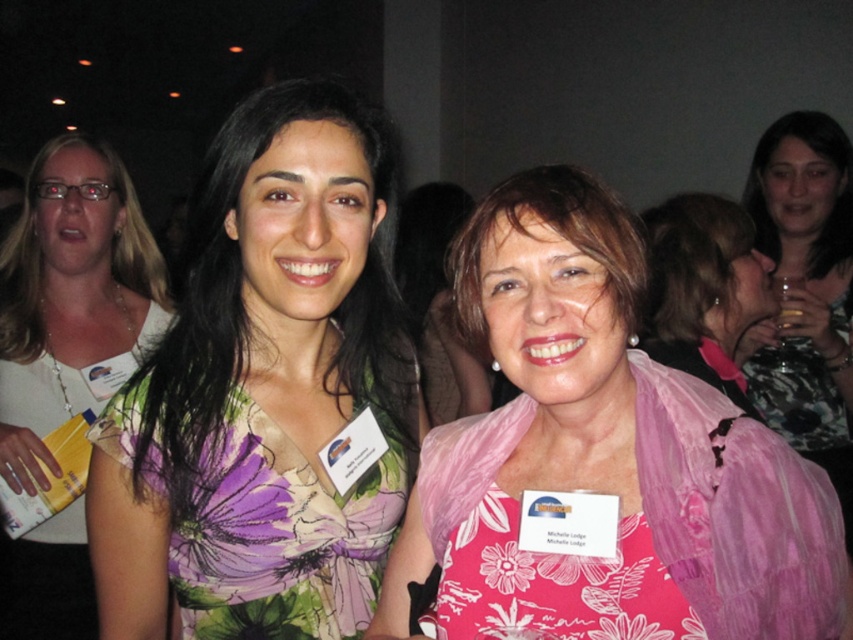
You are a photographer adjusting your camera settings. You notice the white glossy name tag at left in your viewfinder. To avoid glare, you need to ensure the distance between the camera and the name tag is at least 5 feet. Is the current distance sufficient?

The white glossy name tag at left and camera are 5.03 feet apart from each other, so the distance is sufficient as it meets the required minimum of 5 feet to avoid glare.

You are attending a formal event and want to take a photo with the two women in the image. Since both are wearing pink dresses, how can you position yourself to clearly see both the pink floral dress at center and the pink satin dress at center in the photo?

Position yourself so that you can see the pink floral dress at center in front while still capturing the pink satin dress at center behind it, as the pink floral dress at center is in front of the pink satin dress at center.